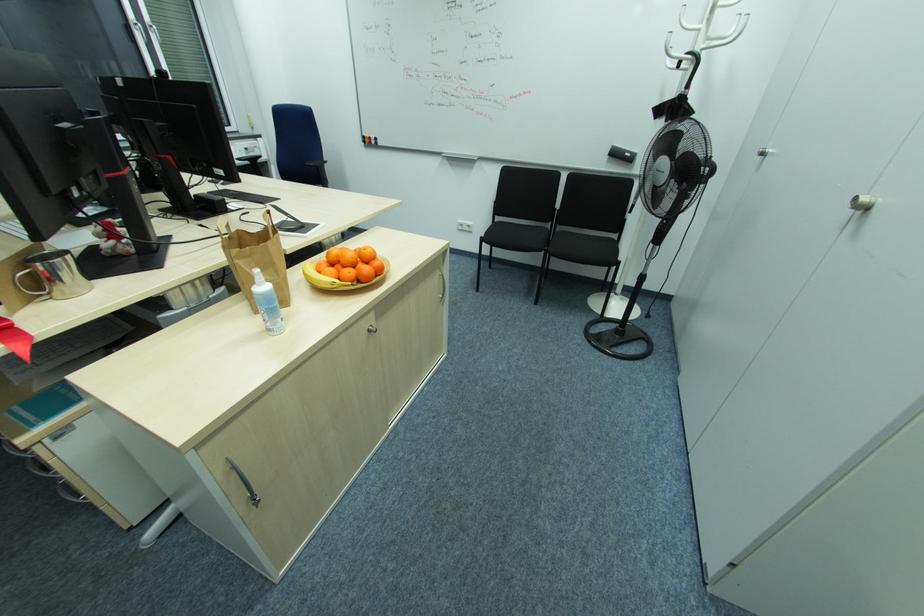
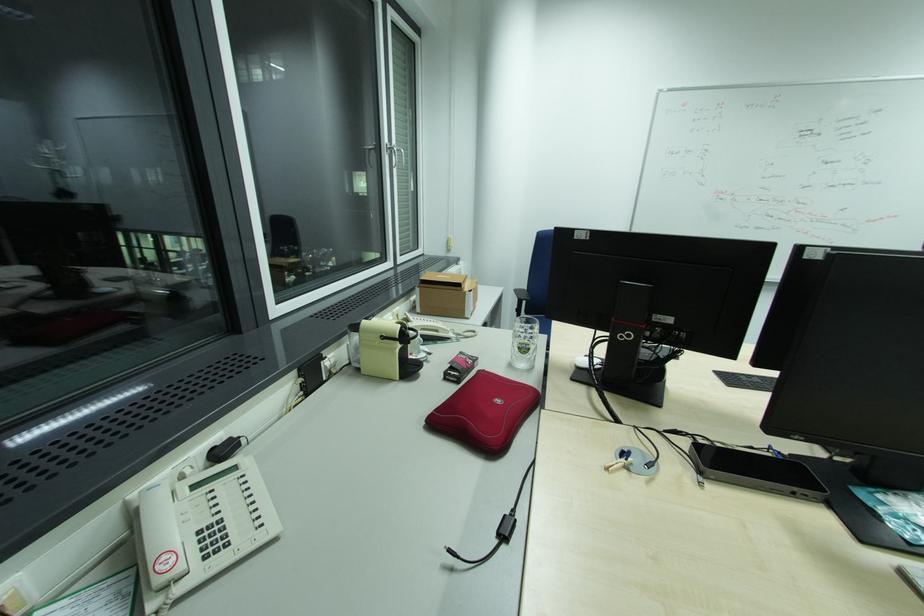
Question: What movement of the cameraman would produce the second image?

Choices:
 (A) Left
 (B) Right
 (C) Forward
 (D) Backward

Answer: (A)